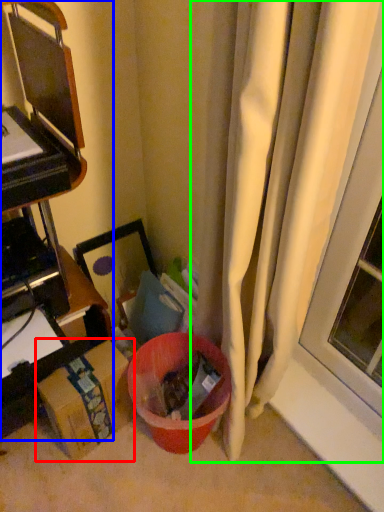
Question: Which object is positioned farthest from cardboard box (highlighted by a red box)? Select from furniture (highlighted by a blue box) and curtain (highlighted by a green box).

Choices:
 (A) furniture
 (B) curtain

Answer: (B)